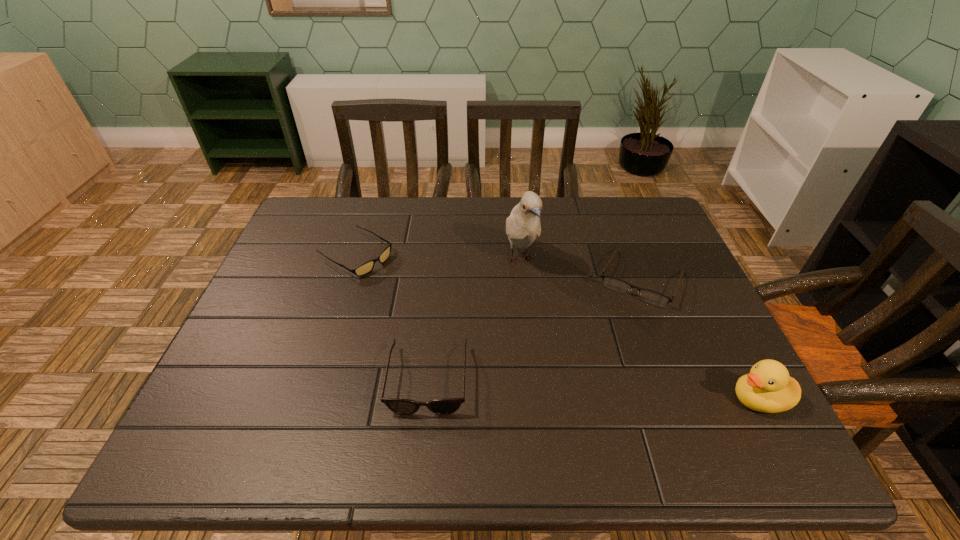
Locate an element on the screen. The width and height of the screenshot is (960, 540). the fourth object from right to left is located at coordinates (399, 406).

Locate an element on the screen. Image resolution: width=960 pixels, height=540 pixels. the third tallest object is located at coordinates (399, 406).

This screenshot has width=960, height=540. In order to click on the second tallest object in this screenshot , I will do `click(768, 388)`.

The image size is (960, 540). Identify the location of the third object from left to right. [523, 225].

I want to click on the tallest object, so click(523, 225).

I want to click on the farther sunglasses, so click(x=365, y=268).

Find the location of a particular element. the left sunglasses is located at coordinates tap(365, 268).

Find the location of a particular element. This screenshot has height=540, width=960. spectacles is located at coordinates (652, 297).

Identify the location of vacant region located 0.310m on the face of the duckling. (578, 399).

Image resolution: width=960 pixels, height=540 pixels. Find the location of `vacant space located 0.220m on the face of the duckling`. vacant space located 0.220m on the face of the duckling is located at coordinates (622, 399).